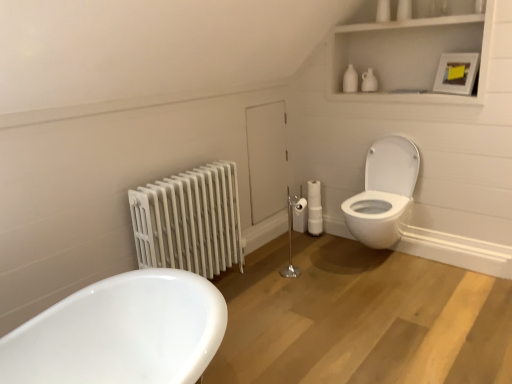
This screenshot has height=384, width=512. I want to click on unoccupied region to the right of white painted metal radiator at left, so click(x=282, y=289).